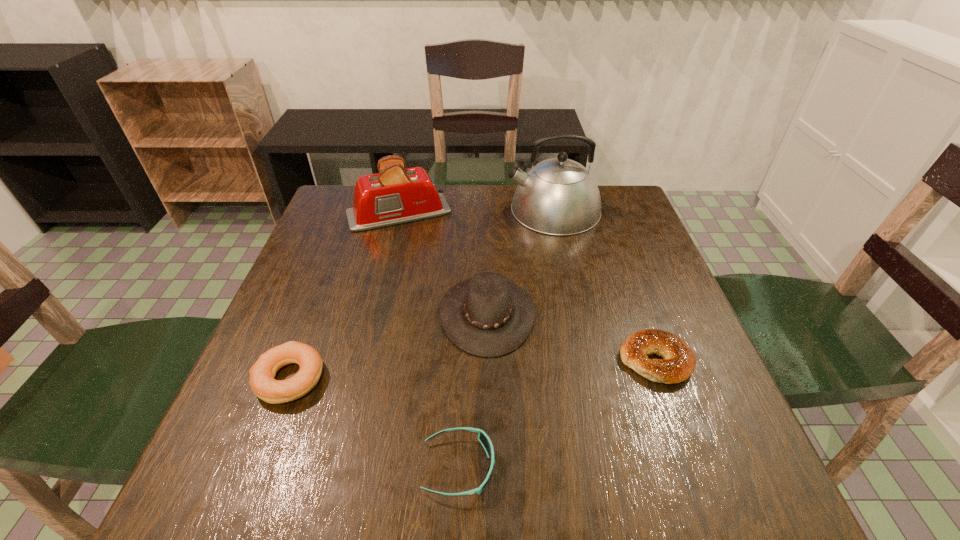
You are a GUI agent. You are given a task and a screenshot of the screen. Output one action in this format:
    pyautogui.click(x=<x>, y=<y>)
    Task: Click on the kettle
    
    Given the screenshot: What is the action you would take?
    pyautogui.click(x=558, y=196)

You are a GUI agent. You are given a task and a screenshot of the screen. Output one action in this format:
    pyautogui.click(x=<x>, y=<y>)
    Task: Click on the fifth shortest object
    This screenshot has width=960, height=540.
    Given the screenshot: What is the action you would take?
    pyautogui.click(x=395, y=195)

You are a GUI agent. You are given a task and a screenshot of the screen. Output one action in this format:
    pyautogui.click(x=<x>, y=<y>)
    Task: Click on the hat
    The image size is (960, 540).
    Given the screenshot: What is the action you would take?
    pyautogui.click(x=488, y=316)

You are a GUI agent. You are given a task and a screenshot of the screen. Output one action in this format:
    pyautogui.click(x=<x>, y=<y>)
    Task: Click on the left bagel
    
    Given the screenshot: What is the action you would take?
    pyautogui.click(x=262, y=373)

Locate an element on the screen. Image resolution: width=960 pixels, height=540 pixels. the right bagel is located at coordinates (678, 364).

Where is `the nearest object`? the nearest object is located at coordinates (483, 438).

This screenshot has height=540, width=960. I want to click on blank space located from the spout of the tallest object, so click(x=401, y=210).

You are a GUI agent. You are given a task and a screenshot of the screen. Output one action in this format:
    pyautogui.click(x=<x>, y=<y>)
    Task: Click on the free spot located 0.380m from the spout of the tallest object
    
    Given the screenshot: What is the action you would take?
    pyautogui.click(x=377, y=210)

This screenshot has height=540, width=960. Find the location of `free space located from the spout of the tallest object`. free space located from the spout of the tallest object is located at coordinates (480, 210).

In order to click on free region located on the right of the toaster in this screenshot , I will do `click(544, 213)`.